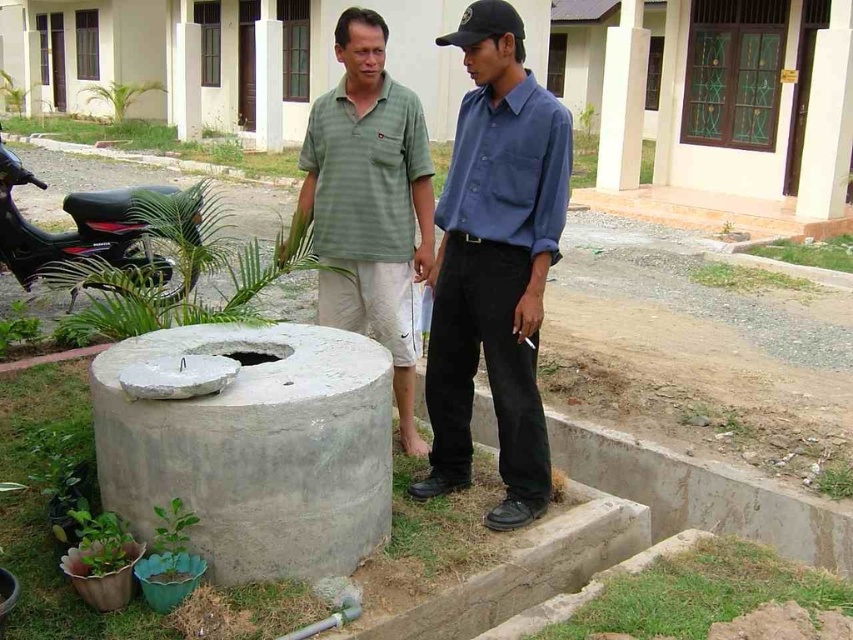
Question: Does blue cotton shirt at center appear over black matte motorcycle at left?

Choices:
 (A) no
 (B) yes

Answer: (A)

Question: Among these objects, which one is farthest from the camera?

Choices:
 (A) blue cotton shirt at center
 (B) black matte motorcycle at left

Answer: (B)

Question: Can you confirm if blue cotton shirt at center is wider than green striped polo shirt at center?

Choices:
 (A) yes
 (B) no

Answer: (B)

Question: Which object is closer to the camera taking this photo?

Choices:
 (A) blue cotton shirt at center
 (B) green striped polo shirt at center
 (C) gray concrete at lower left

Answer: (C)

Question: Which point appears farthest from the camera in this image?

Choices:
 (A) (349, 241)
 (B) (62, 237)
 (C) (289, 369)
 (D) (433, 390)

Answer: (B)

Question: Does blue cotton shirt at center lie in front of green striped polo shirt at center?

Choices:
 (A) no
 (B) yes

Answer: (B)